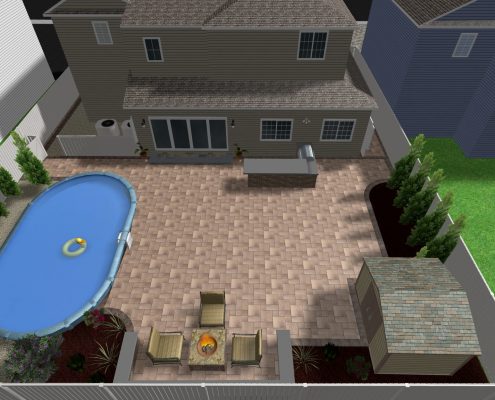
The image size is (495, 400). Find the location of `windows`. windows is located at coordinates (337, 126), (310, 44), (279, 126), (217, 133), (204, 133), (185, 133), (165, 133), (153, 47).